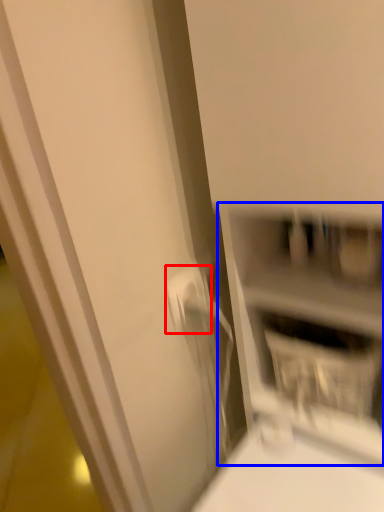
Question: Which object appears closest to the camera in this image, electric outlet (highlighted by a red box) or shelf (highlighted by a blue box)?

Choices:
 (A) electric outlet
 (B) shelf

Answer: (B)